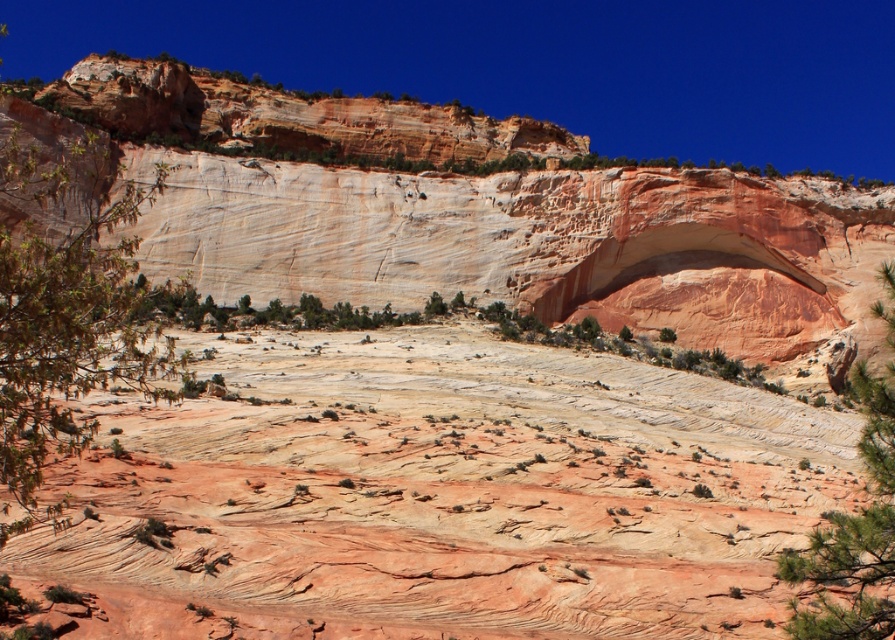
Is rustic sandstone terrain at center taller than green leafy tree at left?

No.

Locate an element on the screen. rustic sandstone terrain at center is located at coordinates (441, 493).

Does green leafy tree at left appear on the right side of green leafy tree at lower right?

No, green leafy tree at left is not to the right of green leafy tree at lower right.

This screenshot has width=895, height=640. Describe the element at coordinates (64, 300) in the screenshot. I see `green leafy tree at left` at that location.

Between point (33, 442) and point (887, 314), which one is positioned in front?

Point (33, 442) is more forward.

Locate an element on the screen. The height and width of the screenshot is (640, 895). green leafy tree at left is located at coordinates (64, 300).

In the scene shown: Who is positioned more to the right, rustic sandstone terrain at center or green leafy tree at lower right?

From the viewer's perspective, green leafy tree at lower right appears more on the right side.

Is rustic sandstone terrain at center closer to the viewer compared to green leafy tree at lower right?

No, rustic sandstone terrain at center is behind green leafy tree at lower right.

The image size is (895, 640). What are the coordinates of `rustic sandstone terrain at center` in the screenshot? It's located at (441, 493).